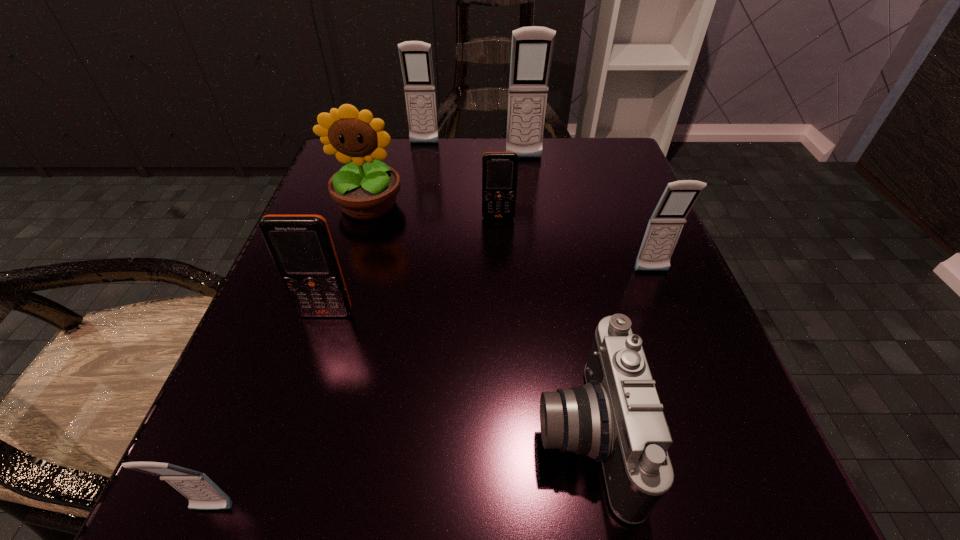
Where is `the seventh nearest object`? This screenshot has height=540, width=960. the seventh nearest object is located at coordinates (532, 47).

In order to click on the tallest object in this screenshot , I will do `click(532, 47)`.

Locate an element on the screen. The height and width of the screenshot is (540, 960). the second gray cellular telephone from left to right is located at coordinates (415, 56).

This screenshot has width=960, height=540. What are the coordinates of `the farthest cellular telephone` in the screenshot? It's located at (415, 56).

You are a GUI agent. You are given a task and a screenshot of the screen. Output one action in this format:
    pyautogui.click(x=<x>, y=<y>)
    Task: Click on the yellow sunflower
    This screenshot has width=960, height=540.
    Given the screenshot: What is the action you would take?
    pyautogui.click(x=364, y=191)

The width and height of the screenshot is (960, 540). In order to click on the fifth farthest object in this screenshot , I will do `click(666, 223)`.

Image resolution: width=960 pixels, height=540 pixels. Identify the location of the rightmost gray cellular telephone. (666, 223).

Identify the location of the left orange cellular telephone. (301, 246).

Locate an element on the screen. The image size is (960, 540). the fifth farthest cellular telephone is located at coordinates (301, 246).

You are a GUI agent. You are given a task and a screenshot of the screen. Output one action in this format:
    pyautogui.click(x=<x>, y=<y>)
    Task: Click on the farther orange cellular telephone
    
    Given the screenshot: What is the action you would take?
    pyautogui.click(x=499, y=169)